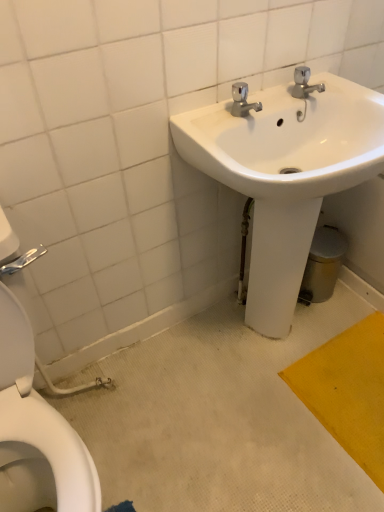
Question: Is white glossy toilet at left next to white glossy sink at upper right and touching it?

Choices:
 (A) no
 (B) yes

Answer: (A)

Question: Is white glossy toilet at left to the right of white glossy sink at upper right from the viewer's perspective?

Choices:
 (A) no
 (B) yes

Answer: (A)

Question: Is white glossy toilet at left at the left side of white glossy sink at upper right?

Choices:
 (A) yes
 (B) no

Answer: (A)

Question: Is white glossy toilet at left facing away from white glossy sink at upper right?

Choices:
 (A) yes
 (B) no

Answer: (B)

Question: Is white glossy toilet at left taller than white glossy sink at upper right?

Choices:
 (A) yes
 (B) no

Answer: (A)

Question: Can you confirm if white glossy toilet at left is wider than white glossy sink at upper right?

Choices:
 (A) yes
 (B) no

Answer: (A)

Question: Does white glossy sink at upper right come in front of white glossy toilet at left?

Choices:
 (A) yes
 (B) no

Answer: (B)

Question: Is white glossy sink at upper right positioned behind white glossy toilet at left?

Choices:
 (A) yes
 (B) no

Answer: (A)

Question: Is white glossy sink at upper right facing away from white glossy toilet at left?

Choices:
 (A) yes
 (B) no

Answer: (B)

Question: Is white glossy toilet at left inside white glossy sink at upper right?

Choices:
 (A) no
 (B) yes

Answer: (A)

Question: From a real-world perspective, is white glossy sink at upper right on top of white glossy toilet at left?

Choices:
 (A) yes
 (B) no

Answer: (B)

Question: Can we say white glossy sink at upper right lies outside white glossy toilet at left?

Choices:
 (A) no
 (B) yes

Answer: (B)

Question: From the image's perspective, is white glossy toilet at left above or below white glossy sink at upper right?

Choices:
 (A) below
 (B) above

Answer: (A)